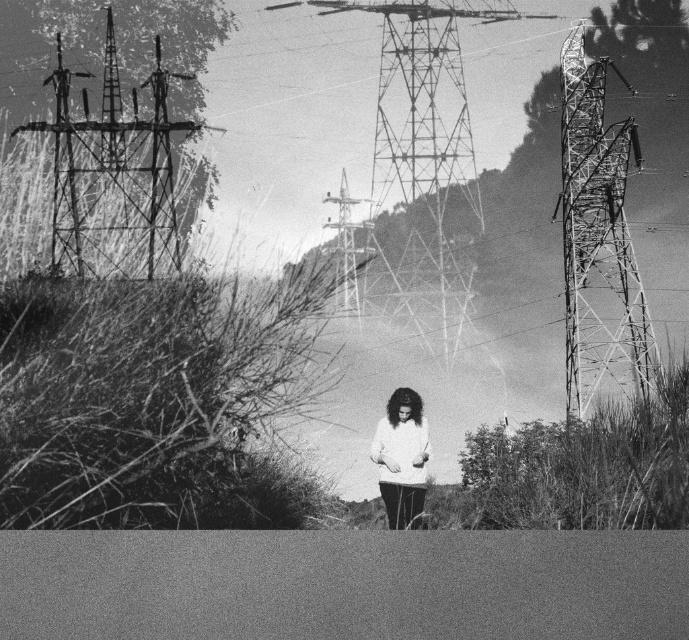
Looking at this image, you are standing at the point labeled as point (113, 173). What is the nearest object to you in the scene?

The nearest object to point (113, 173) is the metallic grid structure at left, as the point is located on it.

Looking at this image, you are a drone operator who needs to fly a drone between the metallic grid structure at left and the metallic tower at center. The drone has a maximum flight distance of 50 feet. Can the drone safely complete this flight without exceeding its limit?

The metallic grid structure at left and metallic tower at center are 51.93 feet apart from each other. Since the drone can only fly up to 50 feet, it cannot safely complete the flight between them as the distance exceeds its maximum range.